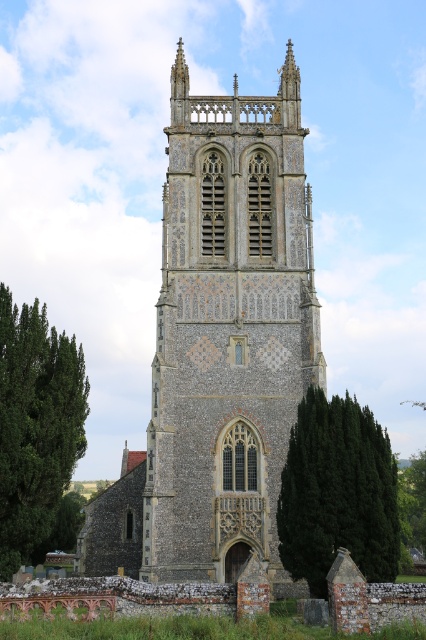
Does stone tower at center have a lesser width compared to green leafy tree at left?

No, stone tower at center is not thinner than green leafy tree at left.

Between stone tower at center and green leafy tree at left, which one appears on the right side from the viewer's perspective?

stone tower at center

Does point (187, 570) lie behind point (63, 348)?

No, (187, 570) is in front of (63, 348).

Identify the location of stone tower at center. (229, 330).

Which is below, dark green coniferous tree at lower right or green leafy tree at left?

dark green coniferous tree at lower right is below.

Between point (362, 412) and point (42, 536), which one is positioned behind?

The point (42, 536) is more distant.

Locate an element on the screen. The width and height of the screenshot is (426, 640). dark green coniferous tree at lower right is located at coordinates (337, 492).

Can you confirm if stone tower at center is taller than dark green coniferous tree at lower right?

Correct, stone tower at center is much taller as dark green coniferous tree at lower right.

Is stone tower at center positioned behind dark green coniferous tree at lower right?

Yes, it is.

Between point (299, 172) and point (376, 456), which one is positioned in front?

Point (376, 456)

Identify the location of stone tower at center. (229, 330).